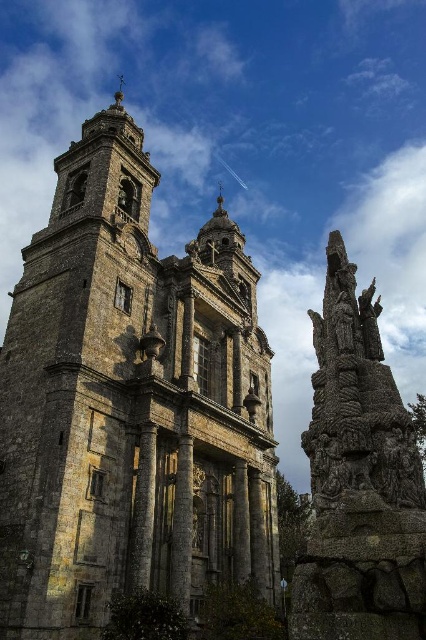
Describe the element at coordinates (129, 404) in the screenshot. I see `stone tower at center` at that location.

Between stone tower at center and rustic stone sculpture at right, which one is positioned higher?

stone tower at center is above.

Which is in front, point (201, 356) or point (382, 406)?

Point (382, 406) is in front.

Locate an element on the screen. This screenshot has width=426, height=640. stone tower at center is located at coordinates (129, 404).